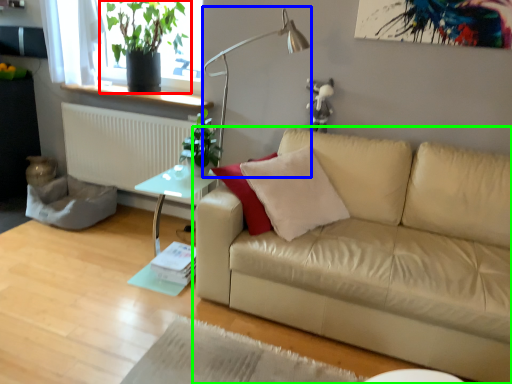
Question: Which object is positioned farthest from houseplant (highlighted by a red box)? Select from table lamp (highlighted by a blue box) and studio couch (highlighted by a green box).

Choices:
 (A) table lamp
 (B) studio couch

Answer: (B)